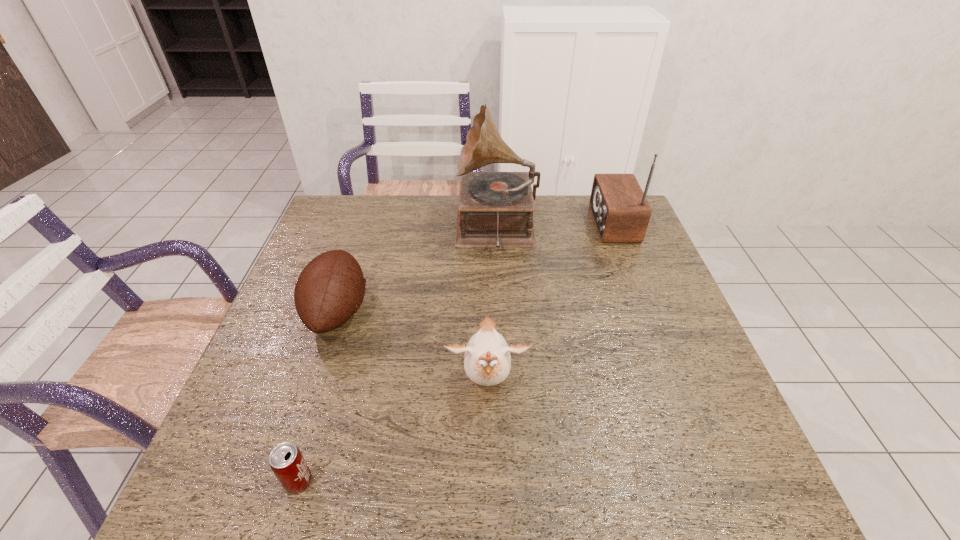
The image size is (960, 540). Identify the location of the tallest object. (495, 209).

Find the location of a particular element. the rightmost object is located at coordinates (621, 212).

Locate an element on the screen. the fourth shortest object is located at coordinates (621, 212).

Where is `bird`? Image resolution: width=960 pixels, height=540 pixels. bird is located at coordinates (487, 361).

You are a GUI agent. You are given a task and a screenshot of the screen. Output one action in this format:
    pyautogui.click(x=<x>, y=<y>)
    Task: Click on the third farthest object
    
    Given the screenshot: What is the action you would take?
    pyautogui.click(x=330, y=289)

Locate an element on the screen. beer can is located at coordinates (286, 461).

Where is `the shortest object`? This screenshot has width=960, height=540. the shortest object is located at coordinates (286, 461).

In order to click on free space located 0.250m from the horn of the tallest object in this screenshot , I will do `click(377, 228)`.

Identify the location of vacant space located 0.340m from the horn of the tallest object. (349, 228).

At what (x,y) coordinates should I click in order to perform the action: click on vacant area located 0.070m from the horn of the tallest object. Please return your answer as a coordinate pair (x, y). The image size is (960, 540). Looking at the image, I should click on (434, 228).